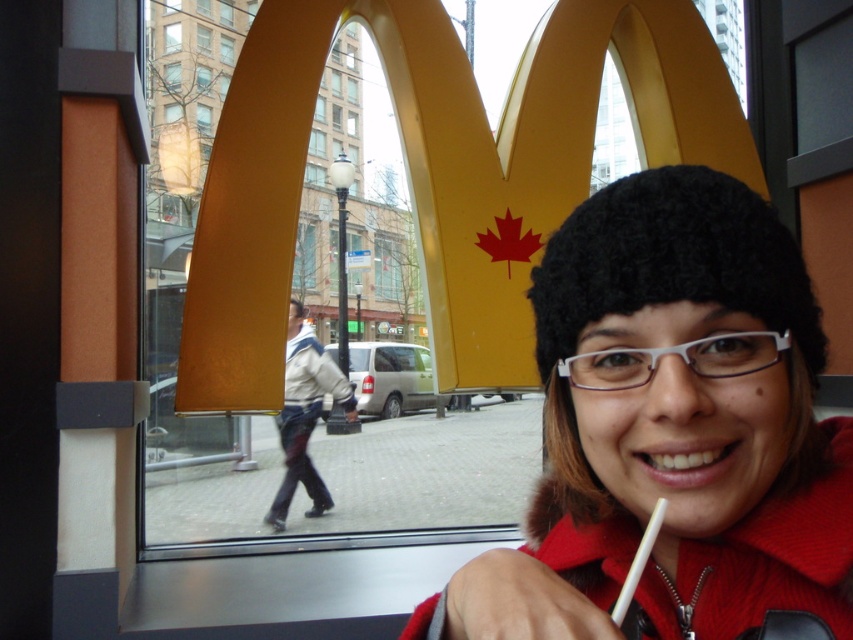
You are a customer sitting at the McDonalds window seat. You want to hand your white fabric jacket at center to the person sitting behind you. Can you reach them by passing it over the black fuzzy hat at upper center?

The black fuzzy hat at upper center is closer to the viewer than the white fabric jacket at center, so the jacket is further away. Therefore, you cannot reach the person behind you by passing the jacket over the hat since the jacket is already positioned behind the hat.

You are a customer in the McDonalds restaurant looking at the window. You notice two items in the image. The first is the black fuzzy hat at upper center and the second is the white fabric jacket at center. Which of these two items appears smaller in size?

The black fuzzy hat at upper center has a smaller size compared to the white fabric jacket at center, so the black fuzzy hat at upper center appears smaller in size.